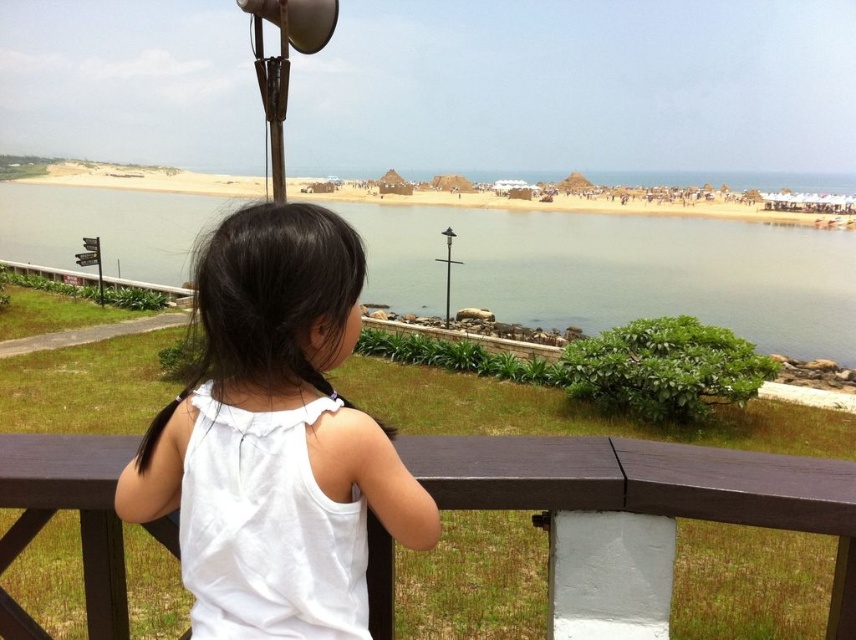
You are standing at the position marked by the point at coordinates (617,269) in the image. Looking around, you see a young girl at a railing, a grassy area, and a wooden railing. Which direction should you face to see the clear blue water at center?

The point at coordinates (617,269) indicates clear blue water at center, so facing forward from that position would allow you to see the clear blue water at center directly ahead.

You are a photographer trying to capture the young girl in the scene. You want to ensure that both the white cotton shirt at center and the brown wooden balustrade at center are visible in your shot. Which object should you position closer to the left side of the frame to achieve this?

The white cotton shirt at center is to the left of the brown wooden balustrade at center, so positioning the white cotton shirt at center closer to the left side of the frame will ensure both objects are visible.